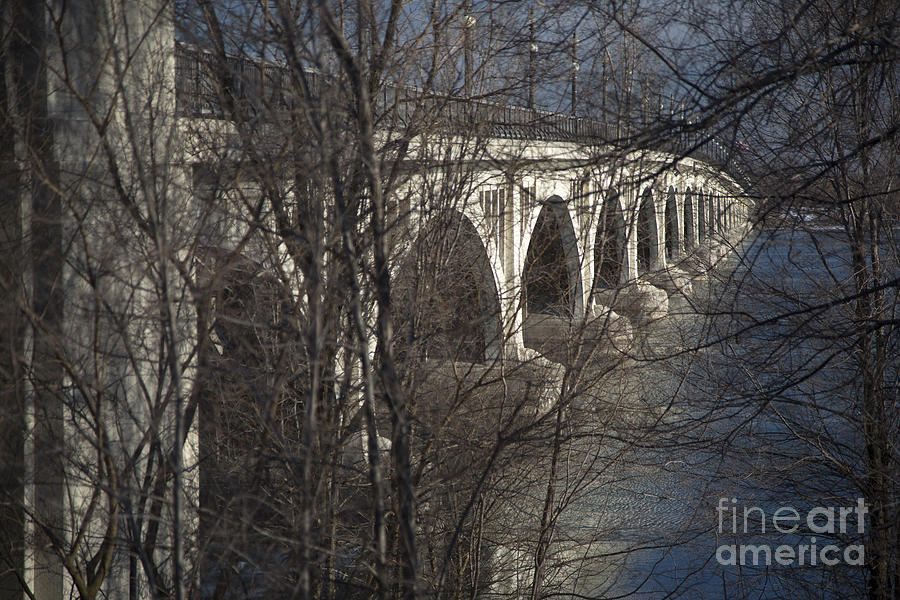
The image size is (900, 600). I want to click on corner, so click(19, 578), click(875, 586), click(878, 19), click(25, 61).